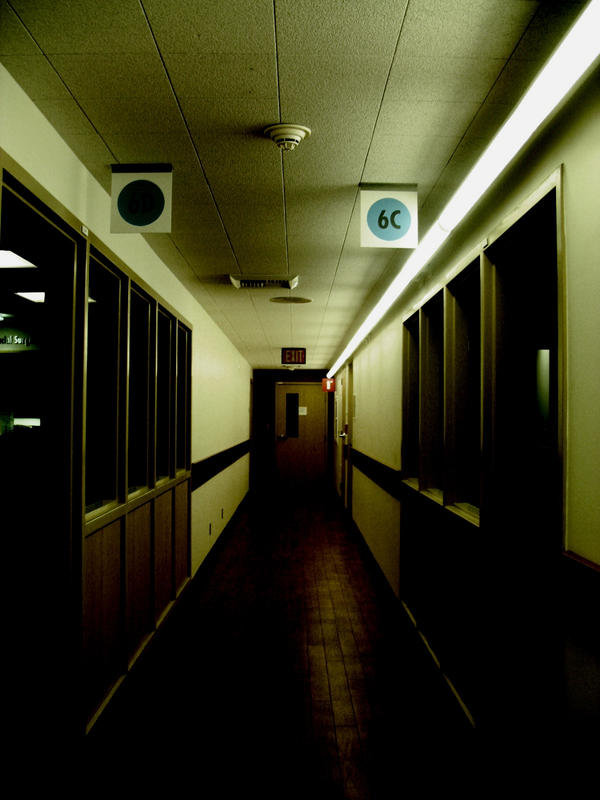
Identify the location of brown paneling. This screenshot has width=600, height=800. (110, 554), (141, 537), (166, 529), (181, 522).